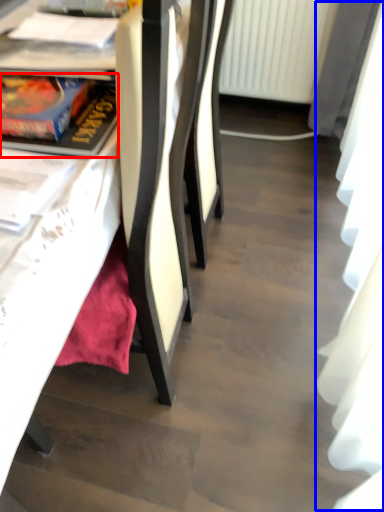
Question: Which object is further to the camera taking this photo, book (highlighted by a red box) or curtain (highlighted by a blue box)?

Choices:
 (A) book
 (B) curtain

Answer: (A)